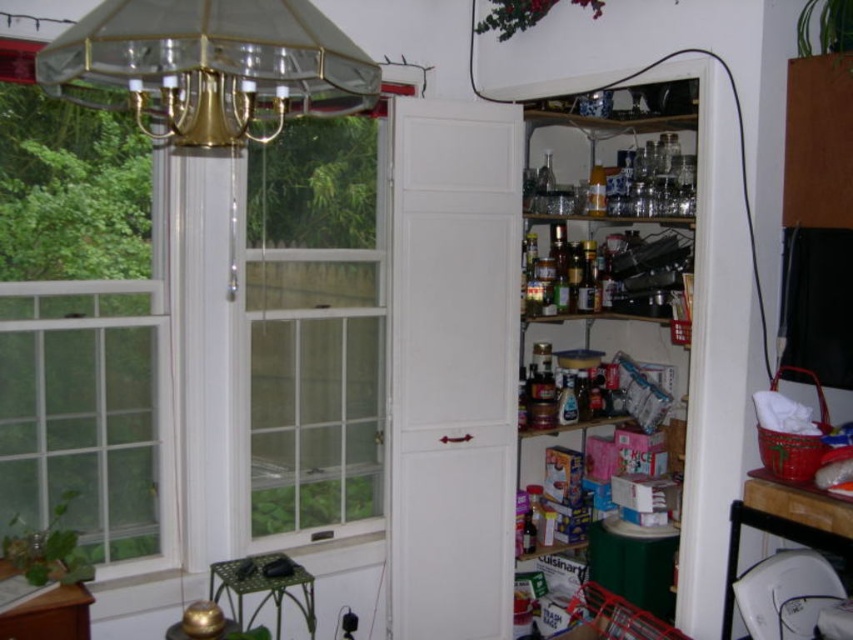
Question: Which point is closer to the camera taking this photo?

Choices:
 (A) (260, 465)
 (B) (61, 163)

Answer: (B)

Question: Is clear glass window at left further to the viewer compared to gold/metallic chandelier at upper left?

Choices:
 (A) yes
 (B) no

Answer: (A)

Question: Which point appears closest to the camera in this image?

Choices:
 (A) (213, 124)
 (B) (347, 310)

Answer: (A)

Question: Which of these objects is positioned closest to the clear glass window at left?

Choices:
 (A) clear plastic containers at upper right
 (B) clear glass window at center
 (C) gold/metallic chandelier at upper left

Answer: (B)

Question: In this image, where is clear plastic containers at upper right located relative to gold/metallic chandelier at upper left?

Choices:
 (A) above
 (B) below

Answer: (B)

Question: Does clear glass window at center have a lesser width compared to clear plastic containers at upper right?

Choices:
 (A) yes
 (B) no

Answer: (A)